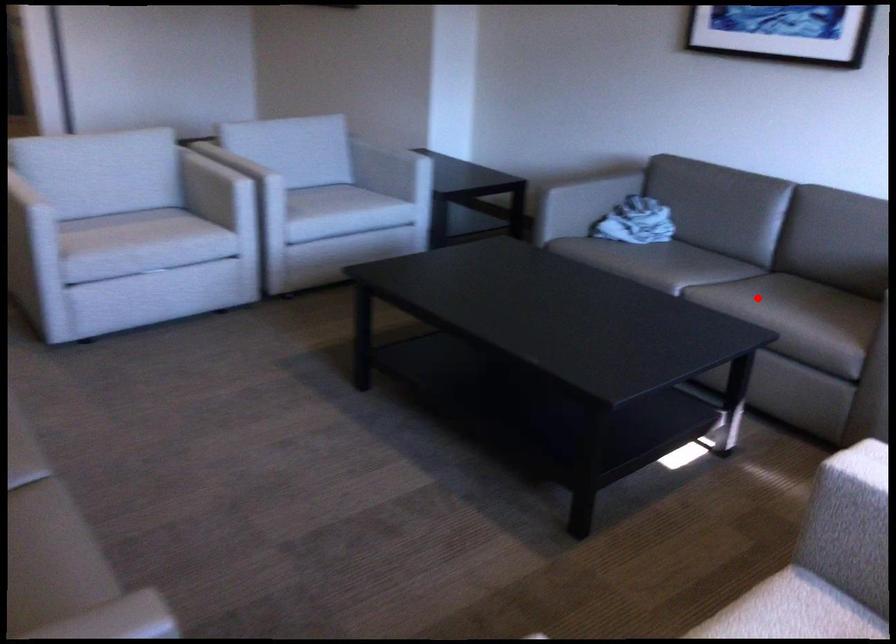
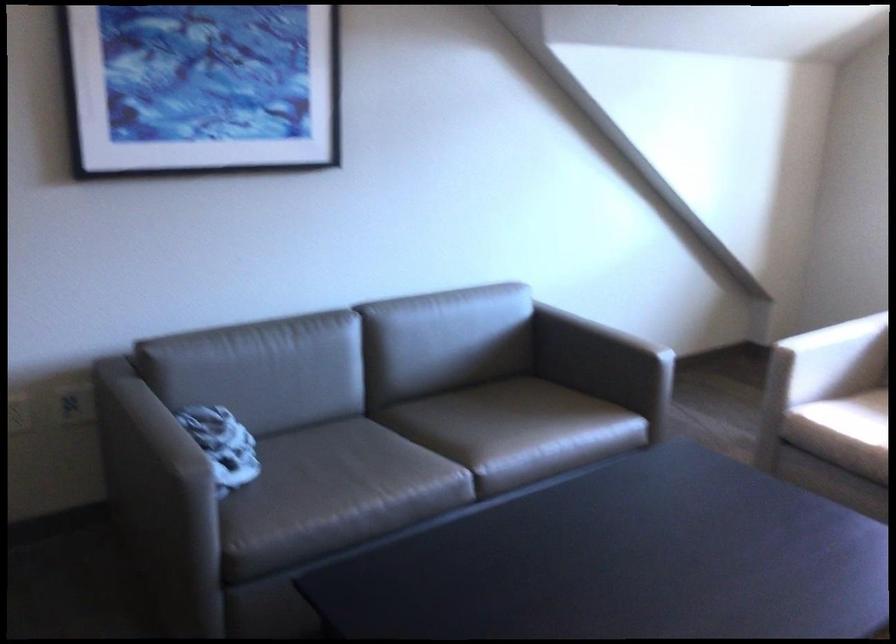
In the second image, find the point that corresponds to the highlighted location in the first image.

(497, 430)